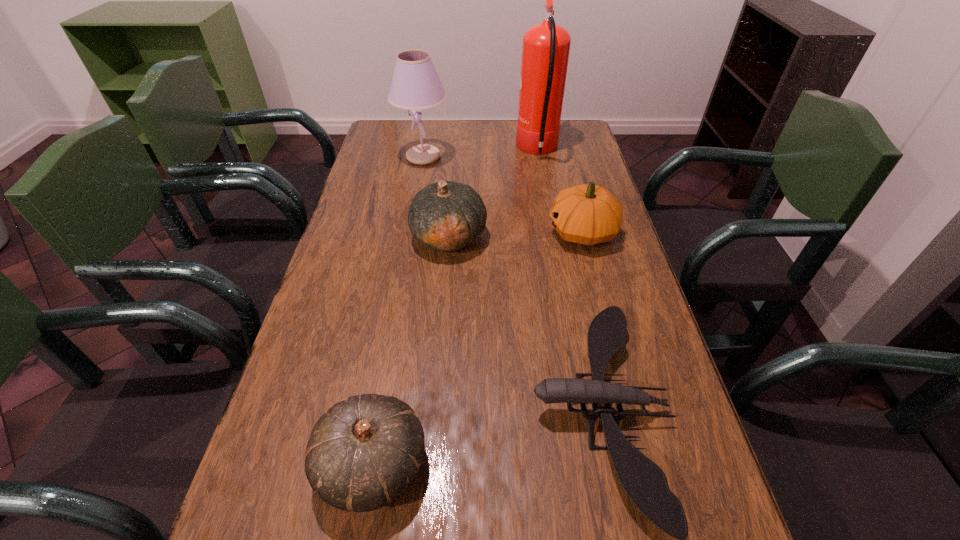
This screenshot has height=540, width=960. In order to click on the second closest gourd to the rightmost gourd in this screenshot , I will do `click(364, 452)`.

Find the location of a particular element. This screenshot has width=960, height=540. free space that satisfies the following two spatial constraints: 1. on the side of the rightmost gourd with the carved face; 2. on the front side of the nearest gourd is located at coordinates (642, 464).